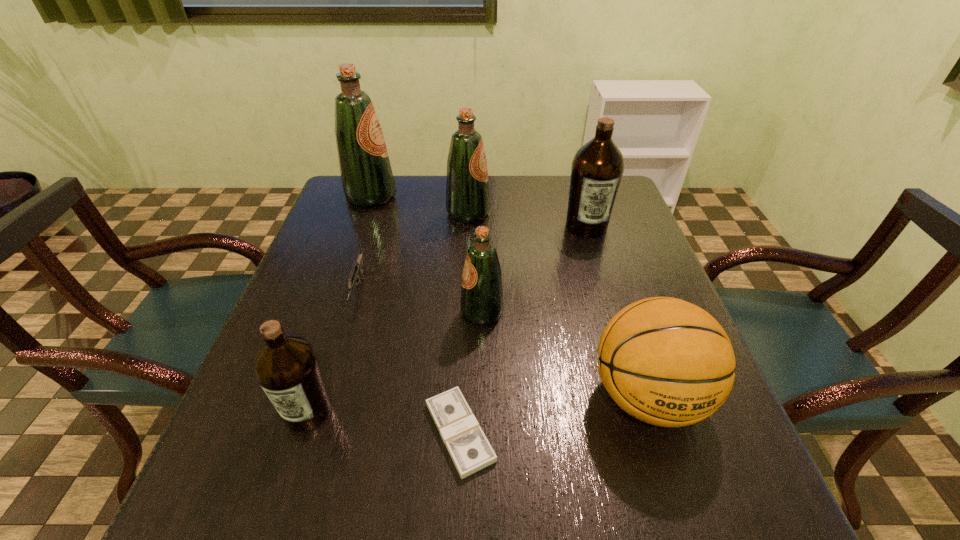
At what (x,y) coordinates should I click in order to perform the action: click on free space in the image that satisfies the following two spatial constraints: 1. aimed along the barrel of the dollar; 2. on the left side of the seventh tallest object. Please return your answer as a coordinate pair (x, y). The image size is (960, 540). Looking at the image, I should click on (313, 432).

Find the location of `free region that satisfies the following two spatial constraints: 1. on the front-facing side of the second biggest green olive oil; 2. on the label of the left brown olive oil`. free region that satisfies the following two spatial constraints: 1. on the front-facing side of the second biggest green olive oil; 2. on the label of the left brown olive oil is located at coordinates (461, 411).

Locate an element on the screen. vacant space that satisfies the following two spatial constraints: 1. on the front-facing side of the second nearest olive oil; 2. on the label of the left brown olive oil is located at coordinates (482, 411).